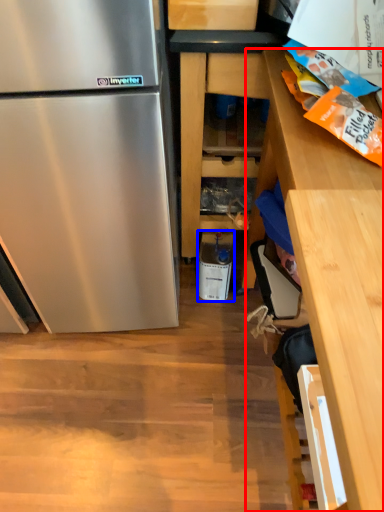
Question: Which of the following is the farthest to the observer, cabinetry (highlighted by a red box) or appliance (highlighted by a blue box)?

Choices:
 (A) cabinetry
 (B) appliance

Answer: (B)